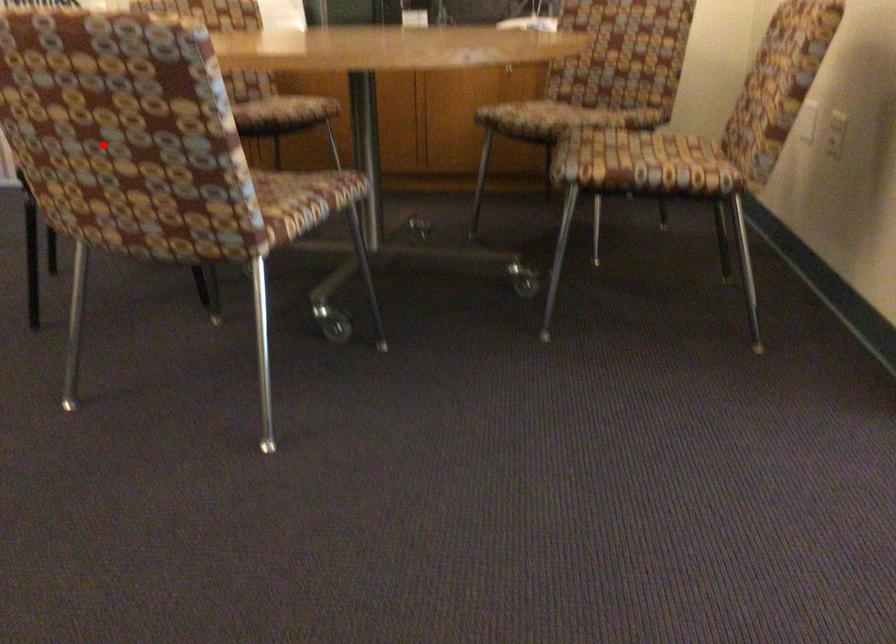
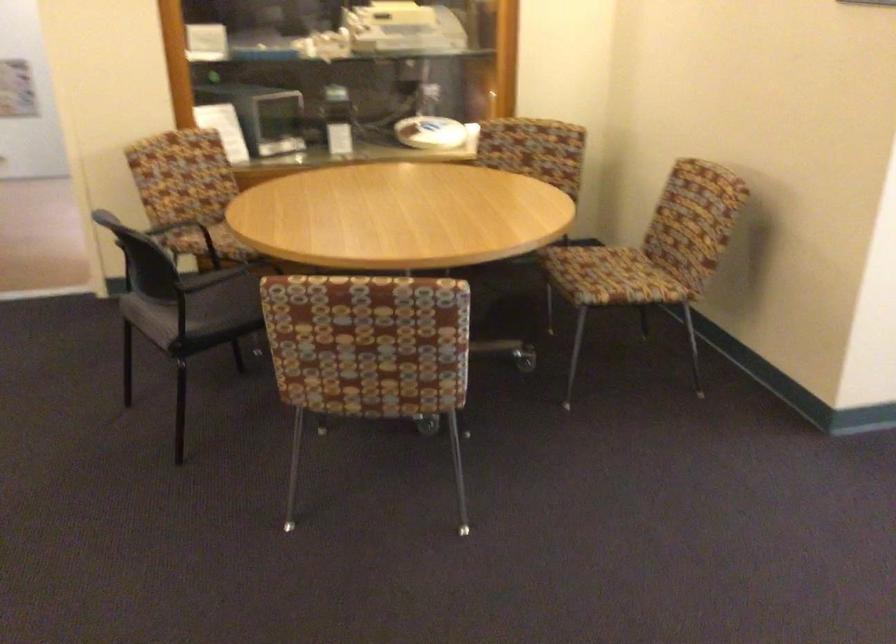
Question: I am providing you with two images of the same scene from different viewpoints. A red point is marked on the first image. At the location where the point appears in image 1, is it still visible in image 2?

Choices:
 (A) Yes
 (B) No

Answer: (A)